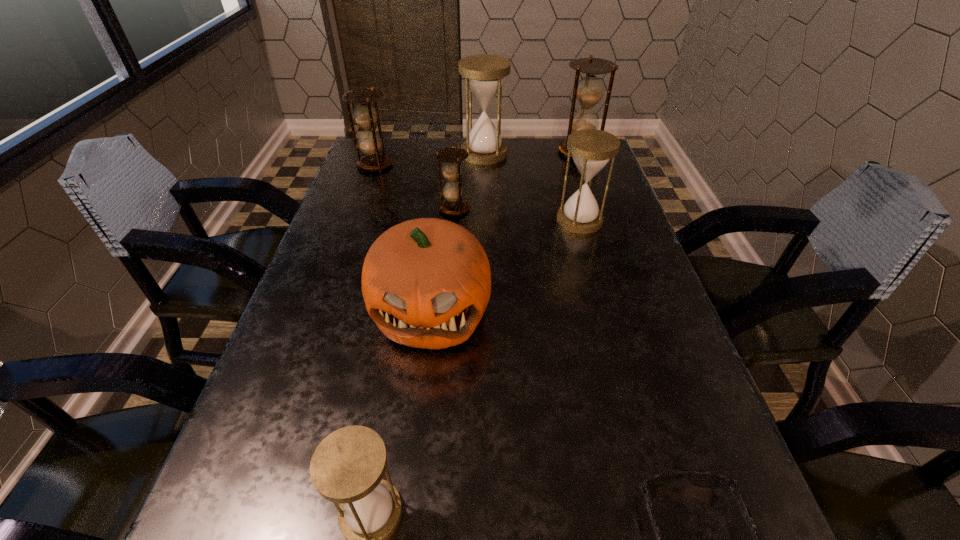
Where is `vacant space at the far edge of the desktop`? vacant space at the far edge of the desktop is located at coordinates (456, 141).

Find the location of a particular element. The image size is (960, 540). free space at the left edge is located at coordinates (354, 325).

Locate an element on the screen. The width and height of the screenshot is (960, 540). free region at the right edge is located at coordinates (603, 303).

You are a GUI agent. You are given a task and a screenshot of the screen. Output one action in this format:
    pyautogui.click(x=<x>, y=<y>)
    Task: Click on the vacant region at the far right corner of the desktop
    Image resolution: width=960 pixels, height=540 pixels.
    Given the screenshot: What is the action you would take?
    pyautogui.click(x=554, y=170)

I want to click on blank region between the farthest white hourglass and the second smallest white hourglass, so click(x=532, y=187).

The width and height of the screenshot is (960, 540). Identify the location of free space between the pumpkin and the biggest brown hourglass. (505, 231).

Image resolution: width=960 pixels, height=540 pixels. In order to click on free space between the nearest brown hourglass and the biggest brown hourglass in this screenshot , I will do `click(516, 180)`.

Locate an element on the screen. The width and height of the screenshot is (960, 540). free space between the farthest white hourglass and the biggest brown hourglass is located at coordinates (532, 153).

You are a GUI agent. You are given a task and a screenshot of the screen. Output one action in this format:
    pyautogui.click(x=<x>, y=<y>)
    Task: Click on the vacant area between the biggest brown hourglass and the nearest brown hourglass
    This screenshot has width=960, height=540.
    Given the screenshot: What is the action you would take?
    pyautogui.click(x=516, y=180)

Image resolution: width=960 pixels, height=540 pixels. Find the location of `vacant space that's between the second brown hourglass from right to left and the leftmost object`. vacant space that's between the second brown hourglass from right to left and the leftmost object is located at coordinates (415, 187).